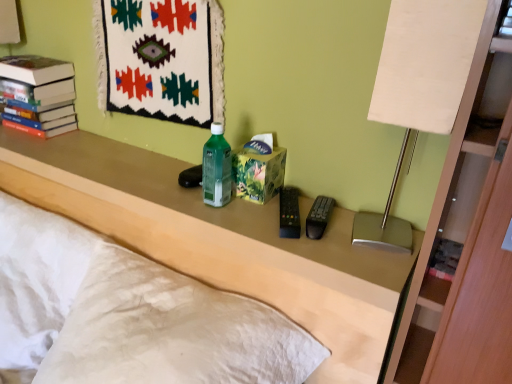
You are a GUI agent. You are given a task and a screenshot of the screen. Output one action in this format:
    pyautogui.click(x=<x>, y=<y>)
    Task: Click on the space that is in front of hardcover books at upper left
    
    Given the screenshot: What is the action you would take?
    pyautogui.click(x=26, y=144)